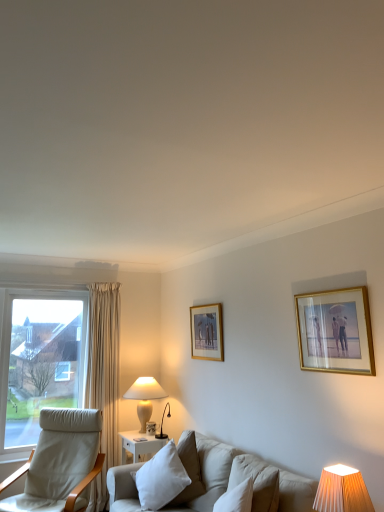
What are the coordinates of `white ceramic table lamp at lower left, placed as the 1th table lamp when sorted from left to right` in the screenshot? It's located at (145, 397).

Describe the element at coordinates (207, 332) in the screenshot. I see `wooden picture frame at center, placed as the second picture frame when sorted from front to back` at that location.

The width and height of the screenshot is (384, 512). What do you see at coordinates (60, 463) in the screenshot?
I see `light beige fabric chair at left` at bounding box center [60, 463].

Where is `white ceramic table lamp at lower left, the 2th table lamp viewed from the front`? Image resolution: width=384 pixels, height=512 pixels. white ceramic table lamp at lower left, the 2th table lamp viewed from the front is located at coordinates (145, 397).

From the image's perspective, between white ceramic table lamp at lower left, the 2th table lamp when ordered from right to left, and orange pleated fabric lampshade at lower right, arranged as the 1th table lamp when viewed from the right, who is located below?

white ceramic table lamp at lower left, the 2th table lamp when ordered from right to left, from the image's perspective.

Which object is closer to the camera taking this photo, white ceramic table lamp at lower left, the 2th table lamp when ordered from right to left, or orange pleated fabric lampshade at lower right, acting as the second table lamp starting from the left?

orange pleated fabric lampshade at lower right, acting as the second table lamp starting from the left, is in front.

Is orange pleated fabric lampshade at lower right, which is the second table lamp from back to front, completely or partially inside white ceramic table lamp at lower left, placed as the 1th table lamp when sorted from left to right?

No.

Does white ceramic table lamp at lower left, the first table lamp in the back-to-front sequence, touch orange pleated fabric lampshade at lower right, arranged as the 1th table lamp when viewed from the right?

white ceramic table lamp at lower left, the first table lamp in the back-to-front sequence, and orange pleated fabric lampshade at lower right, arranged as the 1th table lamp when viewed from the right, are not in contact.

From a real-world perspective, which is physically below, white soft cushion at center or light beige fabric chair at left?

light beige fabric chair at left, from a real-world perspective.

Based on the photo, are white soft cushion at center and light beige fabric chair at left far apart?

Actually, white soft cushion at center and light beige fabric chair at left are a little close together.

Is point (172, 439) closer to camera compared to point (2, 506)?

That is False.

Locate an element on the screen. The height and width of the screenshot is (512, 384). the 2nd picture frame behind the orange pleated fabric lampshade at lower right, arranged as the 1th table lamp when viewed from the right is located at coordinates (207, 332).

In the scene shown: From the image's perspective, is wooden picture frame at center, which is the 1th picture frame from left to right, over orange pleated fabric lampshade at lower right, which ranks as the 1th table lamp in front-to-back order?

Yes, from the image's perspective, wooden picture frame at center, which is the 1th picture frame from left to right, is over orange pleated fabric lampshade at lower right, which ranks as the 1th table lamp in front-to-back order.

How many degrees apart are the facing directions of wooden picture frame at center, which is the 1th picture frame from left to right, and orange pleated fabric lampshade at lower right, arranged as the 1th table lamp when viewed from the right?

The angle between the facing direction of wooden picture frame at center, which is the 1th picture frame from left to right, and the facing direction of orange pleated fabric lampshade at lower right, arranged as the 1th table lamp when viewed from the right, is 1.55 degrees.

Does wooden picture frame at center, placed as the second picture frame when sorted from front to back, turn towards orange pleated fabric lampshade at lower right, arranged as the 1th table lamp when viewed from the right?

No.

How different are the orientations of gold-framed picture at upper right, which is the 1th picture frame from right to left, and orange pleated fabric lampshade at lower right, which ranks as the 1th table lamp in front-to-back order, in degrees?

There is a 1.37-degree angle between the facing directions of gold-framed picture at upper right, which is the 1th picture frame from right to left, and orange pleated fabric lampshade at lower right, which ranks as the 1th table lamp in front-to-back order.

From the picture: Is there a large distance between gold-framed picture at upper right, which appears as the first picture frame when viewed from the front, and orange pleated fabric lampshade at lower right, arranged as the 1th table lamp when viewed from the right?

No, there isn't a large distance between gold-framed picture at upper right, which appears as the first picture frame when viewed from the front, and orange pleated fabric lampshade at lower right, arranged as the 1th table lamp when viewed from the right.

Is gold-framed picture at upper right, which is the second picture frame from left to right, wider or thinner than orange pleated fabric lampshade at lower right, which is the second table lamp from back to front?

Considering their sizes, gold-framed picture at upper right, which is the second picture frame from left to right, looks slimmer than orange pleated fabric lampshade at lower right, which is the second table lamp from back to front.

Which object is positioned more to the left, gold-framed picture at upper right, which is the 1th picture frame from right to left, or orange pleated fabric lampshade at lower right, acting as the second table lamp starting from the left?

orange pleated fabric lampshade at lower right, acting as the second table lamp starting from the left.

Can you confirm if white ceramic table lamp at lower left, the 2th table lamp when ordered from right to left, is smaller than light beige fabric chair at left?

Correct, white ceramic table lamp at lower left, the 2th table lamp when ordered from right to left, occupies less space than light beige fabric chair at left.

From a real-world perspective, is white ceramic table lamp at lower left, the first table lamp in the back-to-front sequence, physically below light beige fabric chair at left?

No, from a real-world perspective, white ceramic table lamp at lower left, the first table lamp in the back-to-front sequence, is not below light beige fabric chair at left.

Can you confirm if white ceramic table lamp at lower left, the first table lamp in the back-to-front sequence, is taller than light beige fabric chair at left?

No.

Is white ceramic table lamp at lower left, the 2th table lamp when ordered from right to left, not near light beige fabric chair at left?

No, white ceramic table lamp at lower left, the 2th table lamp when ordered from right to left, is in close proximity to light beige fabric chair at left.

Which is more to the left, gold-framed picture at upper right, which is the 1th picture frame from right to left, or wooden picture frame at center, the first picture frame from the back?

Positioned to the left is wooden picture frame at center, the first picture frame from the back.

Considering the points (323, 343) and (222, 329), which point is in front, point (323, 343) or point (222, 329)?

Point (323, 343)

Which of these two, gold-framed picture at upper right, which is the 1th picture frame from right to left, or wooden picture frame at center, the second picture frame when ordered from right to left, is thinner?

gold-framed picture at upper right, which is the 1th picture frame from right to left.

Is gold-framed picture at upper right, which appears as the first picture frame when viewed from the front, positioned far away from wooden picture frame at center, the first picture frame from the back?

That's right, there is a large distance between gold-framed picture at upper right, which appears as the first picture frame when viewed from the front, and wooden picture frame at center, the first picture frame from the back.

Consider the image. Is the depth of orange pleated fabric lampshade at lower right, which is the second table lamp from back to front, less than that of wooden picture frame at center, placed as the second picture frame when sorted from front to back?

Yes, the depth of orange pleated fabric lampshade at lower right, which is the second table lamp from back to front, is less than that of wooden picture frame at center, placed as the second picture frame when sorted from front to back.

From a real-world perspective, is orange pleated fabric lampshade at lower right, acting as the second table lamp starting from the left, below wooden picture frame at center, placed as the second picture frame when sorted from front to back?

Answer: Yes.

Looking at this image, how different are the orientations of orange pleated fabric lampshade at lower right, which ranks as the 1th table lamp in front-to-back order, and wooden picture frame at center, which is the 1th picture frame from left to right, in degrees?

The angular difference between orange pleated fabric lampshade at lower right, which ranks as the 1th table lamp in front-to-back order, and wooden picture frame at center, which is the 1th picture frame from left to right, is 1.55 degrees.

I want to click on table lamp behind the orange pleated fabric lampshade at lower right, arranged as the 1th table lamp when viewed from the right, so click(145, 397).

The width and height of the screenshot is (384, 512). In the image, there is a white soft cushion at center. Identify the location of chair below it (from the image's perspective). (60, 463).

Based on their spatial positions, is orange pleated fabric lampshade at lower right, acting as the second table lamp starting from the left, or white ceramic table lamp at lower left, placed as the 1th table lamp when sorted from left to right, further from wooden picture frame at center, the second picture frame when ordered from right to left?

orange pleated fabric lampshade at lower right, acting as the second table lamp starting from the left, lies further to wooden picture frame at center, the second picture frame when ordered from right to left, than the other object.

Looking at the image, which one is located further to white ceramic table lamp at lower left, the first table lamp in the back-to-front sequence, orange pleated fabric lampshade at lower right, which ranks as the 1th table lamp in front-to-back order, or light beige fabric chair at left?

orange pleated fabric lampshade at lower right, which ranks as the 1th table lamp in front-to-back order, is further to white ceramic table lamp at lower left, the first table lamp in the back-to-front sequence.

Estimate the real-world distances between objects in this image. Which object is further from white soft cushion at center, orange pleated fabric lampshade at lower right, which ranks as the 1th table lamp in front-to-back order, or wooden picture frame at center, placed as the second picture frame when sorted from front to back?

orange pleated fabric lampshade at lower right, which ranks as the 1th table lamp in front-to-back order, is positioned further to the anchor white soft cushion at center.

Which object lies further to the anchor point orange pleated fabric lampshade at lower right, which is the second table lamp from back to front, white soft cushion at center or white ceramic table lamp at lower left, the 2th table lamp viewed from the front?

The object further to orange pleated fabric lampshade at lower right, which is the second table lamp from back to front, is white ceramic table lamp at lower left, the 2th table lamp viewed from the front.

Which object lies further to the anchor point light beige fabric chair at left, gold-framed picture at upper right, which appears as the first picture frame when viewed from the front, or white ceramic table lamp at lower left, the 2th table lamp viewed from the front?

gold-framed picture at upper right, which appears as the first picture frame when viewed from the front, is further to light beige fabric chair at left.

Which object lies nearer to the anchor point wooden picture frame at center, the first picture frame from the back, orange pleated fabric lampshade at lower right, which ranks as the 1th table lamp in front-to-back order, or white soft cushion at center?

Among the two, white soft cushion at center is located nearer to wooden picture frame at center, the first picture frame from the back.

From the image, which object appears to be farther from gold-framed picture at upper right, which is the 1th picture frame from right to left, white soft cushion at center or orange pleated fabric lampshade at lower right, which is the second table lamp from back to front?

white soft cushion at center is positioned further to the anchor gold-framed picture at upper right, which is the 1th picture frame from right to left.

Estimate the real-world distances between objects in this image. Which object is further from orange pleated fabric lampshade at lower right, acting as the second table lamp starting from the left, gold-framed picture at upper right, which is the 1th picture frame from right to left, or white soft cushion at center?

Based on the image, white soft cushion at center appears to be further to orange pleated fabric lampshade at lower right, acting as the second table lamp starting from the left.

Identify the location of table lamp located between light beige fabric chair at left and wooden picture frame at center, which is the 1th picture frame from left to right, in the left-right direction. The height and width of the screenshot is (512, 384). (145, 397).

Where is `pillow between light beige fabric chair at left and wooden picture frame at center, placed as the second picture frame when sorted from front to back`? Image resolution: width=384 pixels, height=512 pixels. pillow between light beige fabric chair at left and wooden picture frame at center, placed as the second picture frame when sorted from front to back is located at coordinates (161, 478).

At what (x,y) coordinates should I click in order to perform the action: click on pillow positioned between orange pleated fabric lampshade at lower right, acting as the second table lamp starting from the left, and white ceramic table lamp at lower left, the 2th table lamp viewed from the front, from near to far. Please return your answer as a coordinate pair (x, y). Looking at the image, I should click on (161, 478).

Locate an element on the screen. pillow between orange pleated fabric lampshade at lower right, arranged as the 1th table lamp when viewed from the right, and wooden picture frame at center, the second picture frame when ordered from right to left, along the z-axis is located at coordinates (161, 478).